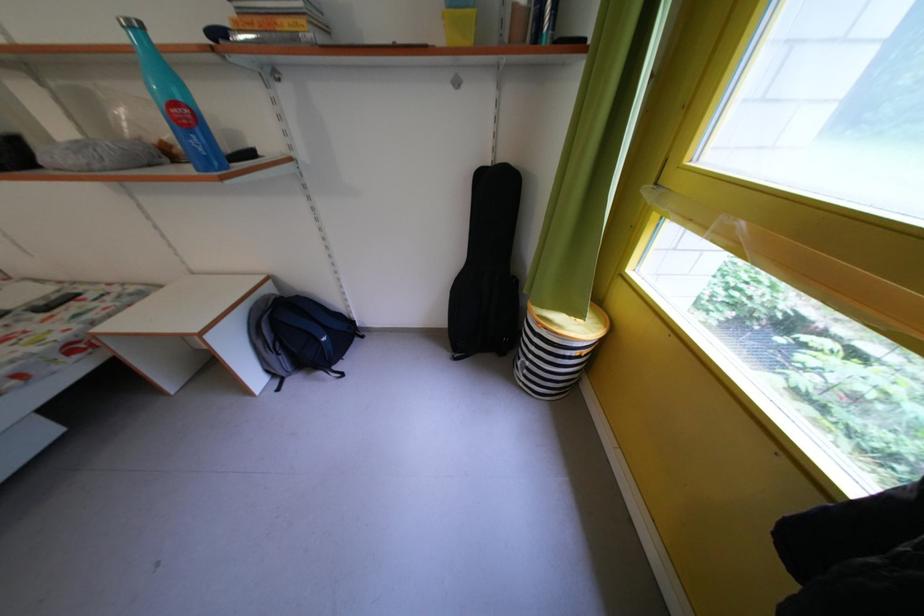
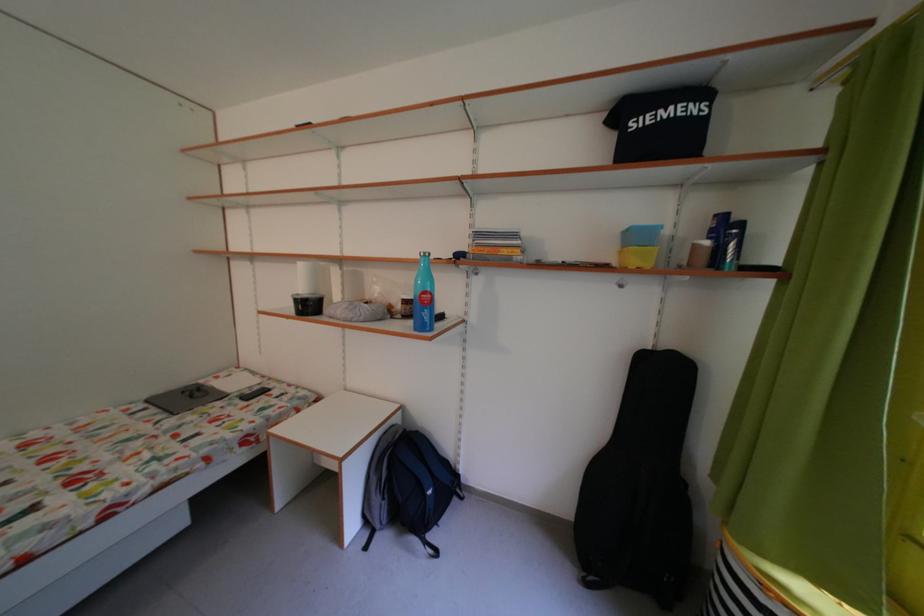
Find the pixel in the second image that matches the point at 287,361 in the first image.

(393, 504)